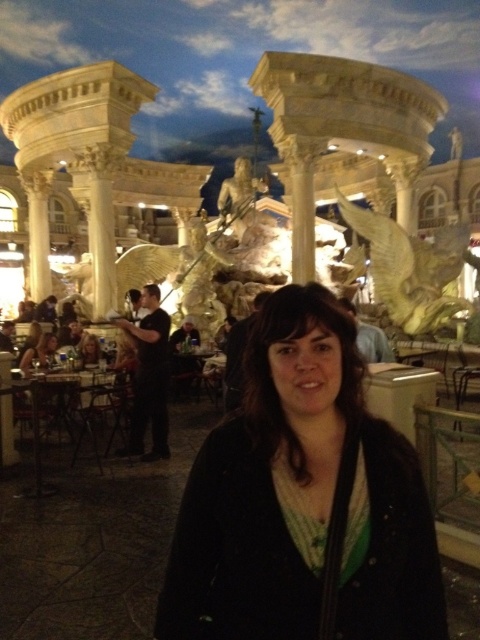
Question: Considering the real-world distances, which object is farthest from the black matte jacket at center?

Choices:
 (A) matte black hair at lower center
 (B) matte black hair at lower left

Answer: (A)

Question: Does black matte jacket at center come in front of matte black hair at lower center?

Choices:
 (A) yes
 (B) no

Answer: (A)

Question: In this image, where is black matte jacket at center located relative to matte black hair at lower center?

Choices:
 (A) above
 (B) below

Answer: (B)

Question: Is black matte jacket at center bigger than matte black hair at lower center?

Choices:
 (A) yes
 (B) no

Answer: (A)

Question: Which of these objects is positioned farthest from the black matte jacket at center?

Choices:
 (A) matte black hair at lower center
 (B) matte black hair at lower left

Answer: (A)

Question: Among these objects, which one is farthest from the camera?

Choices:
 (A) matte black hair at lower center
 (B) matte black hair at lower left
 (C) black matte jacket at center

Answer: (B)